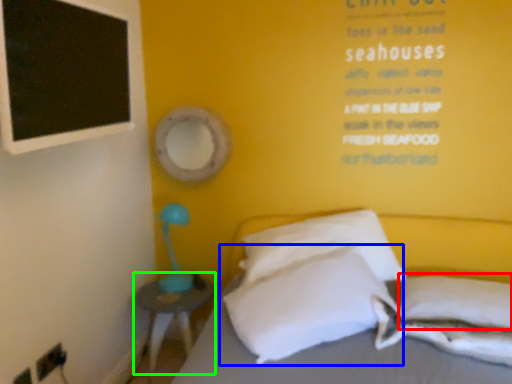
Question: Which object is positioned closest to pillow (highlighted by a red box)? Select from pillow (highlighted by a blue box) and nightstand (highlighted by a green box).

Choices:
 (A) pillow
 (B) nightstand

Answer: (A)